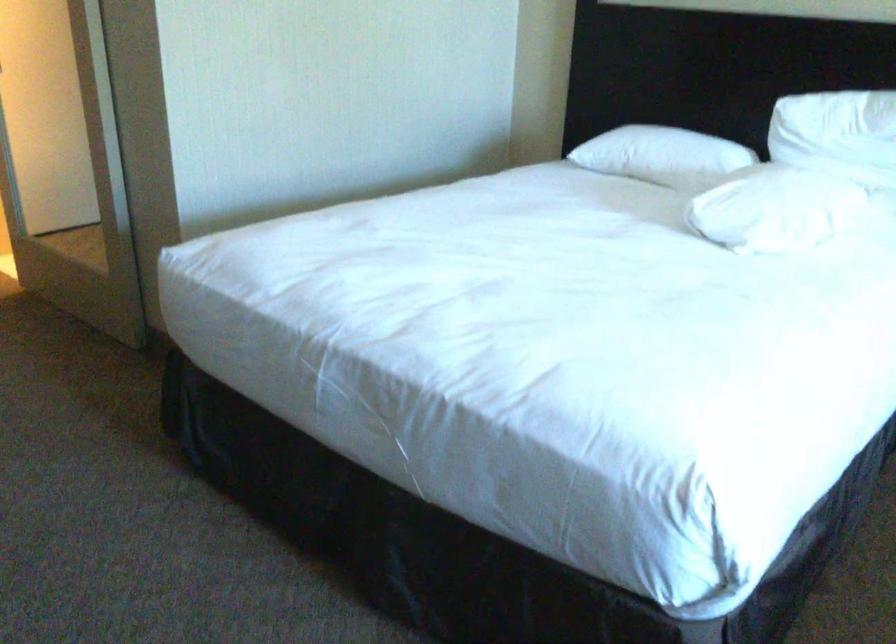
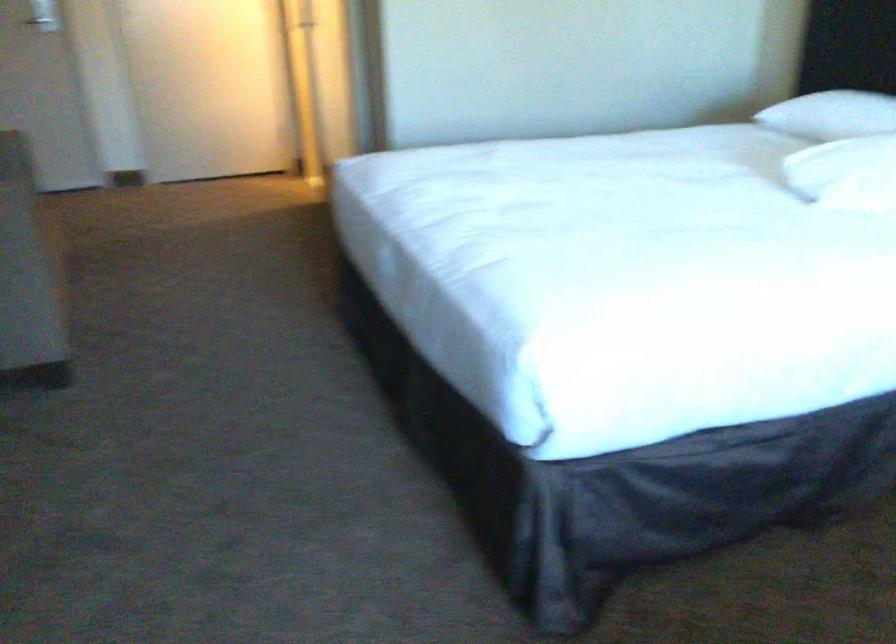
Find the pixel in the second image that matches point 659,154 in the first image.

(831, 115)